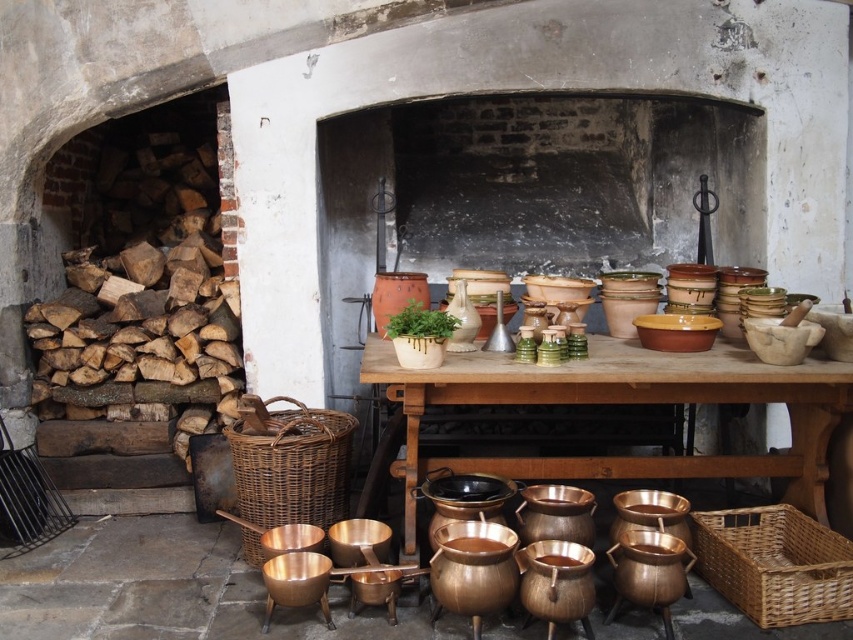
How much distance is there between matte ceramic table at center and woven brown basket at lower center?

28.52 inches

Find the location of `matte ceramic table at center`. matte ceramic table at center is located at coordinates (618, 403).

Does woven brown basket at lower right have a lesser height compared to woven brown basket at lower center?

Yes.

Can you confirm if woven brown basket at lower right is positioned to the right of woven brown basket at lower center?

Indeed, woven brown basket at lower right is positioned on the right side of woven brown basket at lower center.

Is point (747, 612) positioned behind point (289, 419)?

No, it is in front of (289, 419).

The height and width of the screenshot is (640, 853). What are the coordinates of `woven brown basket at lower right` in the screenshot? It's located at (775, 564).

Between matte ceramic table at center and woven brown basket at lower right, which one appears on the left side from the viewer's perspective?

matte ceramic table at center

Locate an element on the screen. matte ceramic table at center is located at coordinates (618, 403).

Locate an element on the screen. The height and width of the screenshot is (640, 853). matte ceramic table at center is located at coordinates (618, 403).